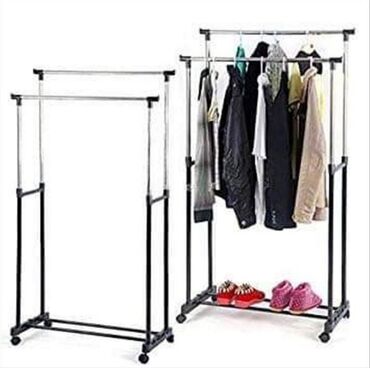
Where is `clothing rack wheels`? This screenshot has width=370, height=368. clothing rack wheels is located at coordinates (48, 320), (18, 340), (145, 357), (173, 338), (183, 316), (213, 286), (323, 335), (349, 312).